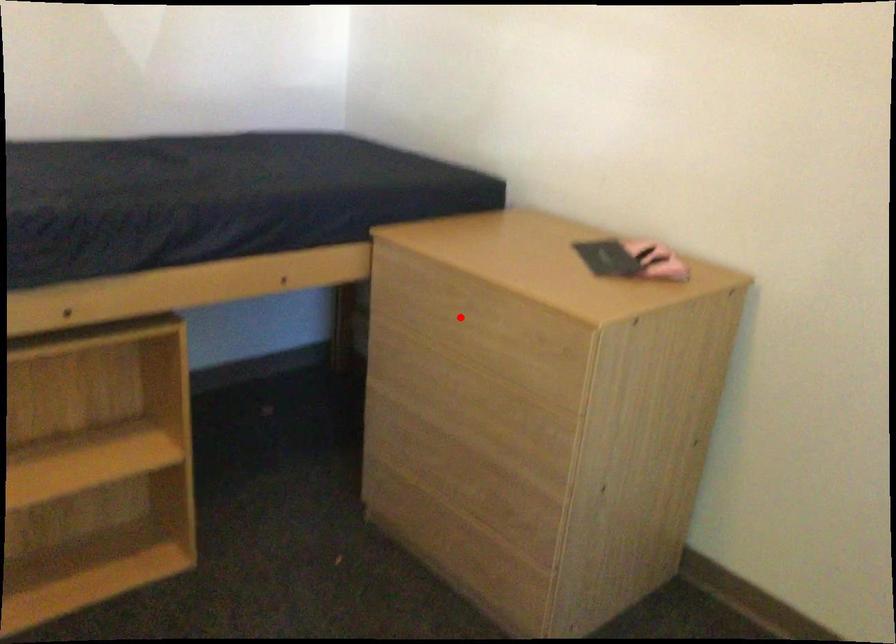
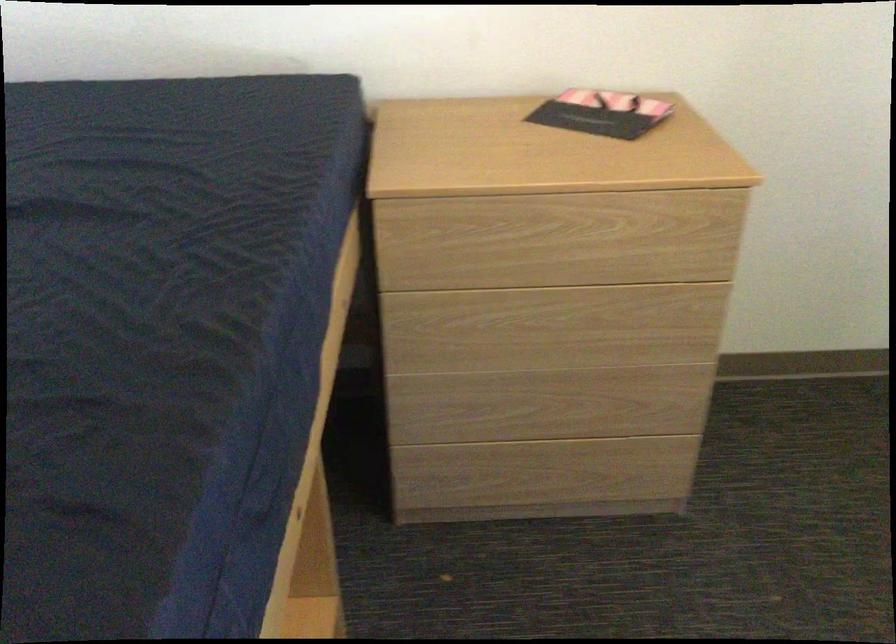
Question: I am providing you with two images of the same scene from different viewpoints. In image1, a red point is highlighted. Considering the same 3D point in image2, which of the following is correct?

Choices:
 (A) It is closer
 (B) It is farther

Answer: (A)